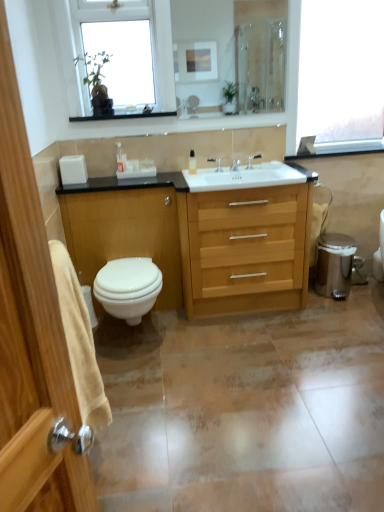
Question: Is white glossy lotion at center, which is the 2th toiletry in right-to-left order, taller or shorter than white matte toilet paper at right?

Choices:
 (A) tall
 (B) short

Answer: (B)

Question: Is white glossy lotion at center, which is the 2th toiletry in right-to-left order, spatially inside white matte toilet paper at right, or outside of it?

Choices:
 (A) outside
 (B) inside

Answer: (A)

Question: Considering the real-world distances, which object is farthest from the white glossy soap dispenser at center, the third toiletry from the left?

Choices:
 (A) matte silver faucet at center, the second tap in the left-to-right sequence
 (B) clear glass window at upper center, which appears as the first window when viewed from the left
 (C) white glossy toilet at lower left
 (D) white glossy lotion at center, which is the first toiletry from left to right
 (E) white glossy toilet at left

Answer: (C)

Question: Estimate the real-world distances between objects in this image. Which object is closer to the matte silver faucet at center, the first tap positioned from the right?

Choices:
 (A) white glossy lotion at center, which is the 2th toiletry in right-to-left order
 (B) transparent glass window at upper right, which is counted as the 1th window, starting from the right
 (C) white glossy soap dispenser at center, the third toiletry from the left
 (D) light wood/wooden chest of drawers at center
 (E) white glossy toilet at left

Answer: (C)